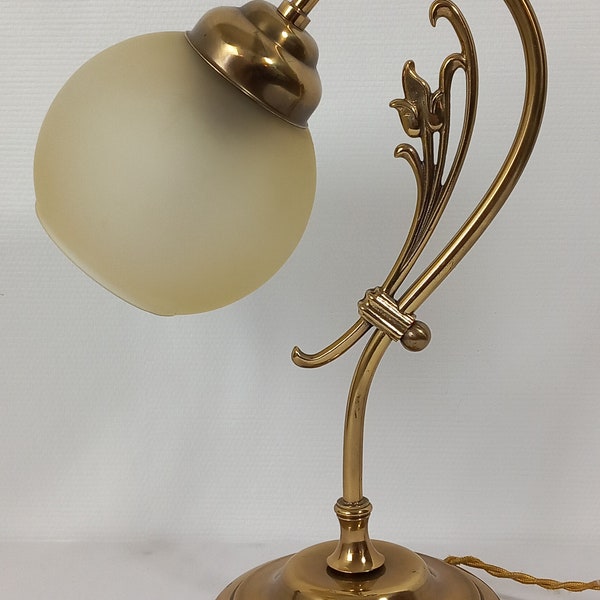
At what (x,y) coordinates should I click in order to perform the action: click on above lamp. Please return your answer as a coordinate pair (x, y). Looking at the image, I should click on (145, 16).